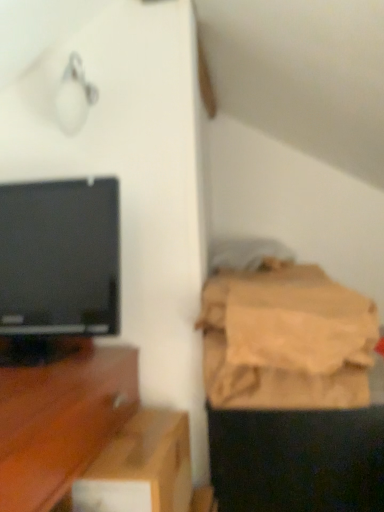
The image size is (384, 512). Describe the element at coordinates (140, 467) in the screenshot. I see `brown cardboard box at lower center` at that location.

The image size is (384, 512). What do you see at coordinates (57, 268) in the screenshot? I see `black glossy television at left` at bounding box center [57, 268].

Image resolution: width=384 pixels, height=512 pixels. What are the coordinates of `brown cardboard box at lower center` in the screenshot? It's located at (140, 467).

Between brown fabric bag at right and brown cardboard box at lower center, which one appears on the left side from the viewer's perspective?

From the viewer's perspective, brown cardboard box at lower center appears more on the left side.

From the picture: Does brown fabric bag at right turn towards brown cardboard box at lower center?

No, brown fabric bag at right is not turned towards brown cardboard box at lower center.

Between brown fabric bag at right and brown cardboard box at lower center, which one has larger size?

With larger size is brown fabric bag at right.

From a real-world perspective, is brown fabric bag at right physically located above or below brown cardboard box at lower center?

brown fabric bag at right is above brown cardboard box at lower center.

Between brown fabric bag at right and black glossy television at left, which one has less height?

brown fabric bag at right is shorter.

Considering the sizes of objects brown fabric bag at right and black glossy television at left in the image provided, who is smaller, brown fabric bag at right or black glossy television at left?

brown fabric bag at right is smaller.

Which is more to the left, brown fabric bag at right or black glossy television at left?

Positioned to the left is black glossy television at left.

Is there a large distance between brown fabric bag at right and black glossy television at left?

brown fabric bag at right is actually quite close to black glossy television at left.

How many degrees apart are the facing directions of wooden tv stand at left and black glossy television at left?

wooden tv stand at left and black glossy television at left are facing 0.697 degrees away from each other.

Is black glossy television at left located within wooden tv stand at left?

No, black glossy television at left is not inside wooden tv stand at left.

From the image's perspective, does wooden tv stand at left appear higher than black glossy television at left?

No.

Is wooden tv stand at left behind black glossy television at left?

No, wooden tv stand at left is in front of black glossy television at left.

Is the position of brown cardboard box at lower center less distant than that of brown fabric bag at right?

Yes, it is.

Between brown cardboard box at lower center and brown fabric bag at right, which one has smaller width?

brown cardboard box at lower center.

From the image's perspective, is brown cardboard box at lower center located beneath brown fabric bag at right?

Yes, from the image's perspective, brown cardboard box at lower center is beneath brown fabric bag at right.

From the image's perspective, is brown fabric bag at right above or below wooden tv stand at left?

brown fabric bag at right is above wooden tv stand at left.

Which is closer to the camera, (322,305) or (45,505)?

Point (322,305) is positioned farther from the camera compared to point (45,505).

How different are the orientations of brown fabric bag at right and wooden tv stand at left in degrees?

The facing directions of brown fabric bag at right and wooden tv stand at left are 1.33 degrees apart.

Does brown fabric bag at right contain wooden tv stand at left?

No, brown fabric bag at right does not contain wooden tv stand at left.

Which of these two, wooden tv stand at left or brown fabric bag at right, is smaller?

With smaller size is brown fabric bag at right.

The width and height of the screenshot is (384, 512). What are the coordinates of `furniture located underneath the brown fabric bag at right (from a real-world perspective)` in the screenshot? It's located at (61, 422).

Between point (107, 394) and point (267, 340), which one is positioned behind?

The point (107, 394) is more distant.

Would you consider wooden tv stand at left to be distant from brown fabric bag at right?

That's not correct — wooden tv stand at left is a little close to brown fabric bag at right.

Is brown cardboard box at lower center taller or shorter than black glossy television at left?

Clearly, brown cardboard box at lower center is shorter compared to black glossy television at left.

Does brown cardboard box at lower center appear on the left side of black glossy television at left?

No, brown cardboard box at lower center is not to the left of black glossy television at left.

Does brown cardboard box at lower center have a greater width compared to black glossy television at left?

Incorrect, the width of brown cardboard box at lower center does not surpass that of black glossy television at left.

Between point (123, 483) and point (63, 203), which one is positioned in front?

The point (123, 483) is more forward.

Locate an element on the screen. Image resolution: width=384 pixels, height=512 pixels. sheet to the right of brown cardboard box at lower center is located at coordinates (286, 339).

You are a GUI agent. You are given a task and a screenshot of the screen. Output one action in this format:
    pyautogui.click(x=<x>, y=<y>)
    Task: Click on the sheet that is below the black glossy television at left (from the image's perspective)
    
    Given the screenshot: What is the action you would take?
    pyautogui.click(x=286, y=339)

Looking at the image, which one is located closer to black glossy television at left, wooden tv stand at left or brown cardboard box at lower center?

wooden tv stand at left is closer to black glossy television at left.

From the image, which object appears to be farther from wooden tv stand at left, brown fabric bag at right or black glossy television at left?

Among the two, brown fabric bag at right is located further to wooden tv stand at left.

Looking at the image, which one is located further to black glossy television at left, brown cardboard box at lower center or wooden tv stand at left?

brown cardboard box at lower center.

Based on their spatial positions, is wooden tv stand at left or brown fabric bag at right further from black glossy television at left?

Based on the image, brown fabric bag at right appears to be further to black glossy television at left.

From the image, which object appears to be farther from brown fabric bag at right, black glossy television at left or wooden tv stand at left?

black glossy television at left lies further to brown fabric bag at right than the other object.

When comparing their distances from brown fabric bag at right, does wooden tv stand at left or brown cardboard box at lower center seem further?

Based on the image, wooden tv stand at left appears to be further to brown fabric bag at right.

Based on their spatial positions, is wooden tv stand at left or black glossy television at left closer to brown fabric bag at right?

wooden tv stand at left is positioned closer to the anchor brown fabric bag at right.

When comparing their distances from brown cardboard box at lower center, does black glossy television at left or wooden tv stand at left seem further?

black glossy television at left.

This screenshot has width=384, height=512. Identify the location of cardboard box between wooden tv stand at left and brown fabric bag at right in the horizontal direction. (140, 467).

The width and height of the screenshot is (384, 512). What are the coordinates of `furniture between black glossy television at left and brown cardboard box at lower center vertically` in the screenshot? It's located at (61, 422).

Locate an element on the screen. television between wooden tv stand at left and brown fabric bag at right is located at coordinates (57, 268).

Find the location of `cardboard box situated between black glossy television at left and brown fabric bag at right from left to right`. cardboard box situated between black glossy television at left and brown fabric bag at right from left to right is located at coordinates (140, 467).